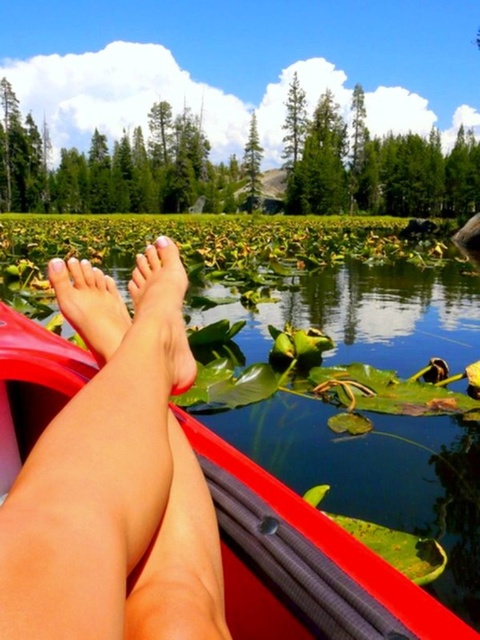
You are sitting in the red kayak and looking forward. There are two points marked in the water. Which point is closer to you, the point at coordinates (x=186, y=376) or the point at (x=107, y=310)?

The point at coordinates (x=186, y=376) is closer to you because it is in front of the point at (x=107, y=310).

You are a photographer trying to capture the skinny legs at center and the pink matte feet at lower left in the same frame. Which object should you focus on first to ensure both are in the shot?

You should focus on the skinny legs at center first because it is much taller than the pink matte feet at lower left, so adjusting the camera angle to include its height will naturally include the shorter pink matte feet at lower left in the frame.

You are a photographer trying to capture the pink matte feet at lower left and the skinny legs at center in the same frame. Based on their positions, which object should you adjust your camera to focus on first to ensure both are in the shot?

Since the skinny legs at center is to the right of pink matte feet at lower left, you should focus on the pink matte feet at lower left first to ensure both objects are captured in the frame.